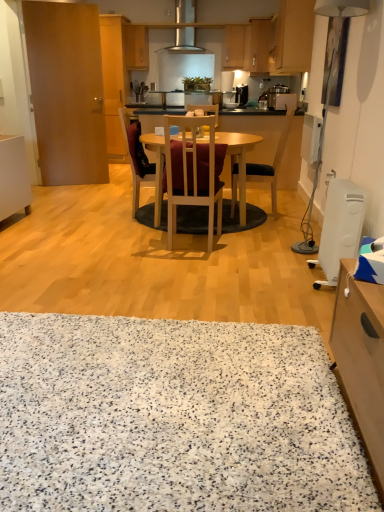
At what (x,y) coordinates should I click in order to perform the action: click on vacant space situated on the left part of white plastic lamp at right. Please return your answer as a coordinate pair (x, y). Looking at the image, I should click on (277, 250).